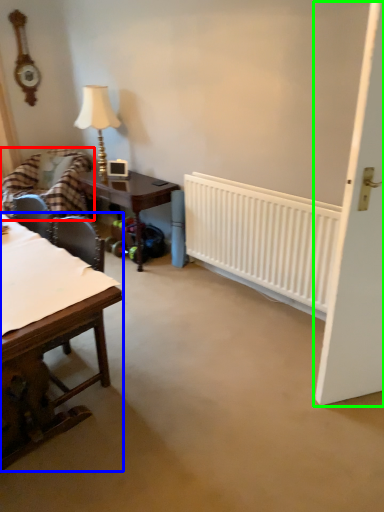
Question: Which object is positioned farthest from chair (highlighted by a red box)? Select from table (highlighted by a blue box) and door (highlighted by a green box).

Choices:
 (A) table
 (B) door

Answer: (B)